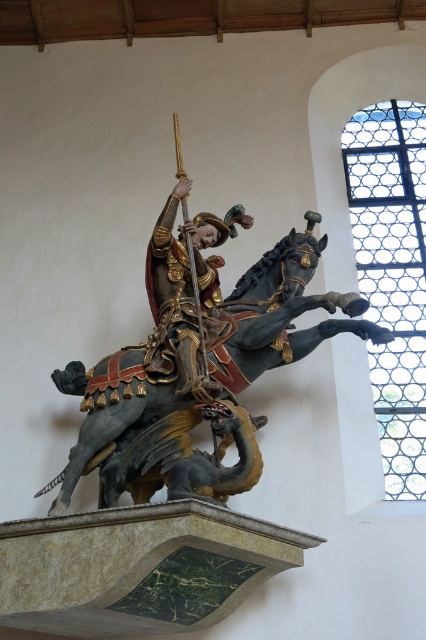
You are an art conservator examining the sculpture. You notice the polished dark gray horse at center and the gold polished armor at center. Which object is positioned lower in the sculpture?

The polished dark gray horse at center is positioned below the gold polished armor at center, so the horse is lower.

You are standing in front of the wooden sculpture of the knight and dragon. There is a point at coordinates point [247,300]. If you want to touch this point with a 50 meter long pole, will you be able to reach it?

The point [247,300] is 53.74 meters from the viewer. Since the pole is only 50 meters long, you cannot reach it.